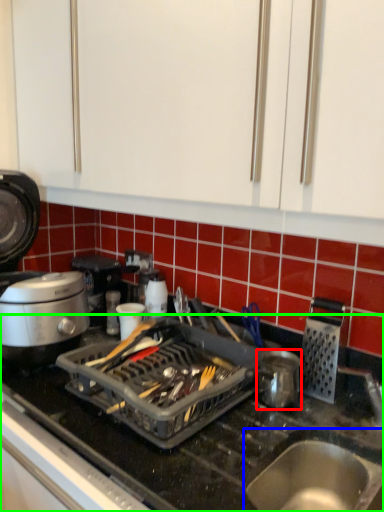
Question: Which object is positioned farthest from kitchen appliance (highlighted by a red box)? Select from sink (highlighted by a blue box) and countertop (highlighted by a green box).

Choices:
 (A) sink
 (B) countertop

Answer: (B)